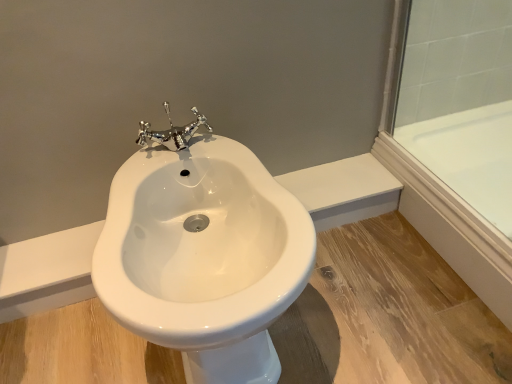
Question: In terms of height, does white glossy bidet at center look taller or shorter compared to transparent glass door at upper right?

Choices:
 (A) tall
 (B) short

Answer: (A)

Question: Looking at the image, does white glossy bidet at center seem bigger or smaller compared to transparent glass door at upper right?

Choices:
 (A) big
 (B) small

Answer: (A)

Question: Looking at their shapes, would you say white glossy bidet at center is wider or thinner than transparent glass door at upper right?

Choices:
 (A) wide
 (B) thin

Answer: (A)

Question: Looking at their shapes, would you say transparent glass door at upper right is wider or thinner than white glossy bidet at center?

Choices:
 (A) thin
 (B) wide

Answer: (A)

Question: Based on their sizes in the image, would you say transparent glass door at upper right is bigger or smaller than white glossy bidet at center?

Choices:
 (A) big
 (B) small

Answer: (B)

Question: Based on their positions, is transparent glass door at upper right located to the left or right of white glossy bidet at center?

Choices:
 (A) left
 (B) right

Answer: (B)

Question: From the image's perspective, is transparent glass door at upper right positioned above or below white glossy bidet at center?

Choices:
 (A) below
 (B) above

Answer: (B)